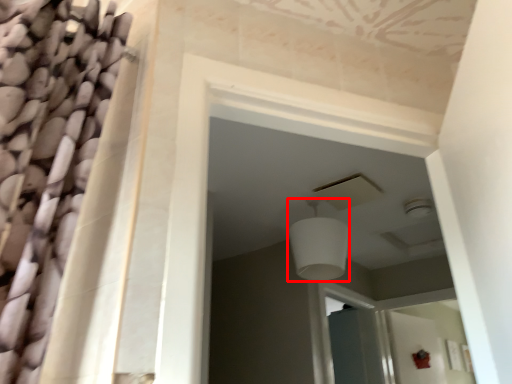
Question: From the image's perspective, what is the correct spatial positioning of light fixture (annotated by the red box) in reference to screen door?

Choices:
 (A) above
 (B) below

Answer: (A)